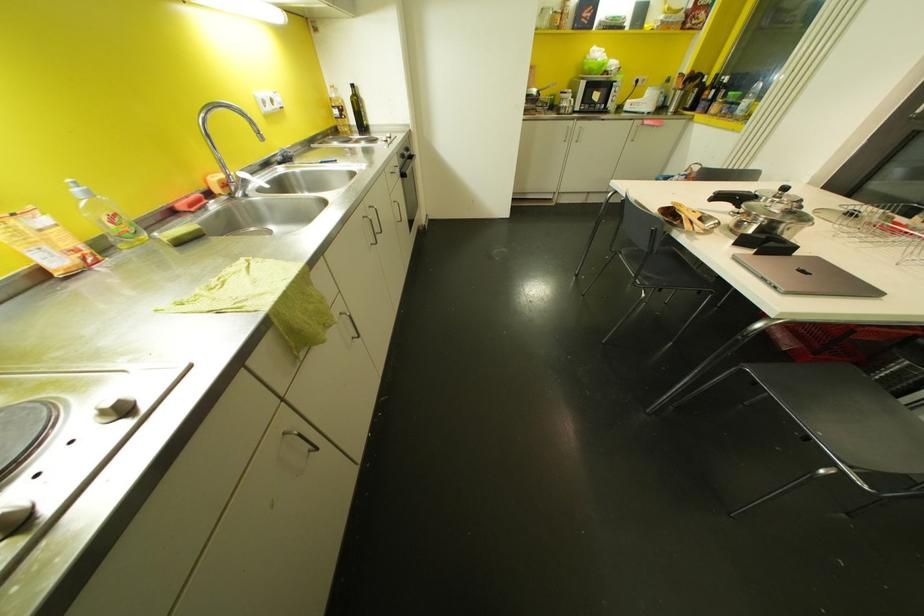
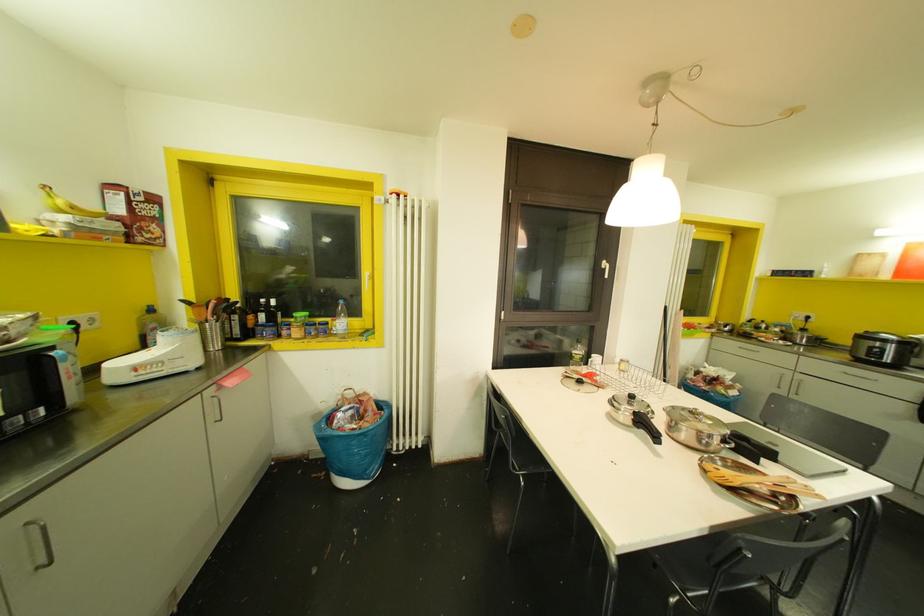
Where in the second image is the point corresponding to point 625,107 from the first image?

(116, 378)